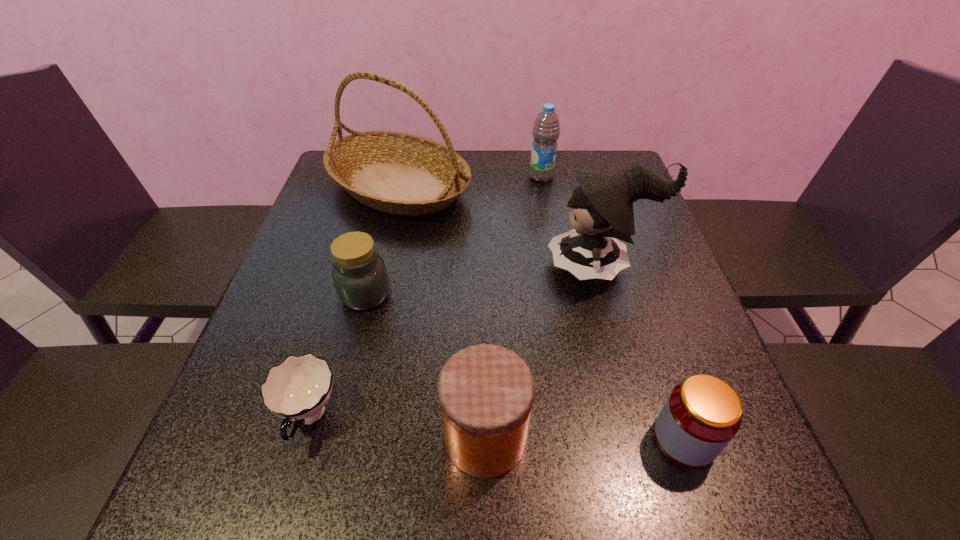
Locate an element on the screen. Image resolution: width=960 pixels, height=540 pixels. vacant space at the far left corner of the desktop is located at coordinates (333, 189).

You are a GUI agent. You are given a task and a screenshot of the screen. Output one action in this format:
    pyautogui.click(x=<x>, y=<y>)
    Task: Click on the vacant position at the near left corner of the desktop
    The height and width of the screenshot is (540, 960).
    Given the screenshot: What is the action you would take?
    pyautogui.click(x=191, y=498)

Where is `vacant area at the near right corner of the desktop`? This screenshot has width=960, height=540. vacant area at the near right corner of the desktop is located at coordinates (720, 483).

The image size is (960, 540). Identify the location of empty space between the fourth tallest object and the basket. (442, 312).

Locate an element on the screen. The width and height of the screenshot is (960, 540). vacant area that lies between the water bottle and the rightmost jar is located at coordinates (612, 308).

Where is `vacant point located between the cup and the water bottle`? vacant point located between the cup and the water bottle is located at coordinates (425, 297).

The image size is (960, 540). Find the location of `unoccupied area between the cup and the third tallest object`. unoccupied area between the cup and the third tallest object is located at coordinates (425, 297).

You are a GUI agent. You are given a task and a screenshot of the screen. Output one action in this format:
    pyautogui.click(x=<x>, y=<y>)
    Task: Click on the vacant space that is in between the water bottle and the tallest jar
    This screenshot has height=540, width=960.
    Given the screenshot: What is the action you would take?
    pyautogui.click(x=514, y=307)

The height and width of the screenshot is (540, 960). In order to click on free space between the doll and the second jar from left to right in this screenshot , I will do `click(543, 352)`.

Locate an element on the screen. This screenshot has height=540, width=960. vacant space that is in between the fourth shortest object and the basket is located at coordinates (442, 312).